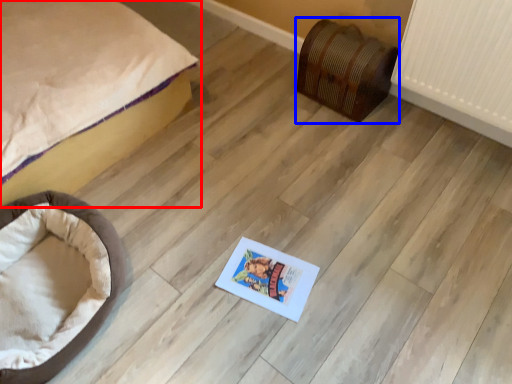
Question: Among these objects, which one is nearest to the camera, bed (highlighted by a red box) or furniture (highlighted by a blue box)?

Choices:
 (A) bed
 (B) furniture

Answer: (A)